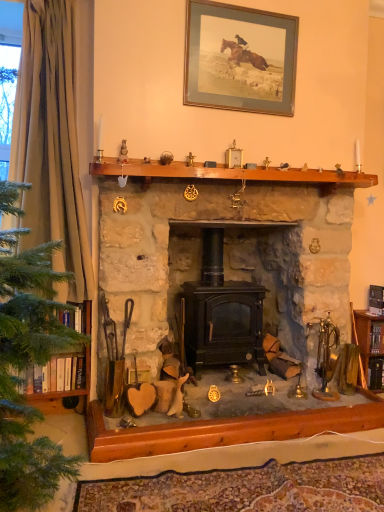
The image size is (384, 512). Describe the element at coordinates (228, 173) in the screenshot. I see `brown wooden mantle at upper center` at that location.

What is the approximate width of green fabric curtain at left?

green fabric curtain at left is 8.47 inches in width.

What are the coordinates of `gold-framed print at upper center` in the screenshot? It's located at (240, 58).

Considering the sizes of objects green fabric curtain at left and matte black wood-burning stove at center in the image provided, who is wider, green fabric curtain at left or matte black wood-burning stove at center?

matte black wood-burning stove at center.

Which object is more forward, green fabric curtain at left or matte black wood-burning stove at center?

matte black wood-burning stove at center.

Would you say green fabric curtain at left is a long distance from matte black wood-burning stove at center?

That's not correct — green fabric curtain at left is a little close to matte black wood-burning stove at center.

Can you confirm if matte black wood-burning stove at center is bigger than gold-framed print at upper center?

Indeed, matte black wood-burning stove at center has a larger size compared to gold-framed print at upper center.

Is matte black wood-burning stove at center beside gold-framed print at upper center?

matte black wood-burning stove at center and gold-framed print at upper center are not in contact.

Could you tell me if matte black wood-burning stove at center is turned towards gold-framed print at upper center?

No, matte black wood-burning stove at center is not oriented towards gold-framed print at upper center.

From the image's perspective, is matte black wood-burning stove at center positioned above or below gold-framed print at upper center?

matte black wood-burning stove at center is situated lower than gold-framed print at upper center in the image.

Can you confirm if brown wooden mantle at upper center is taller than gold-framed print at upper center?

No.

From the picture: Which object is closer to the camera, brown wooden mantle at upper center or gold-framed print at upper center?

brown wooden mantle at upper center.

From the image's perspective, does brown wooden mantle at upper center appear lower than gold-framed print at upper center?

Yes, from the image's perspective, brown wooden mantle at upper center is beneath gold-framed print at upper center.

Between point (336, 181) and point (276, 109), which one is positioned in front?

The point (276, 109) is in front.

Is gold-framed print at upper center to the left or to the right of green fabric curtain at left in the image?

In the image, gold-framed print at upper center appears on the right side of green fabric curtain at left.

Is gold-framed print at upper center not within green fabric curtain at left?

gold-framed print at upper center is positioned outside green fabric curtain at left.

From a real-world perspective, is gold-framed print at upper center positioned over green fabric curtain at left based on gravity?

Indeed, from a real-world perspective, gold-framed print at upper center stands above green fabric curtain at left.

Does point (186, 16) come in front of point (68, 195)?

That is True.

From the image's perspective, which one is positioned higher, gold-framed print at upper center or brown wooden mantle at upper center?

gold-framed print at upper center is shown above in the image.

In the scene shown: Is gold-framed print at upper center positioned with its back to brown wooden mantle at upper center?

No, gold-framed print at upper center's orientation is not away from brown wooden mantle at upper center.

What's the angular difference between gold-framed print at upper center and brown wooden mantle at upper center's facing directions?

gold-framed print at upper center and brown wooden mantle at upper center are facing 0.236 degrees away from each other.

Between point (286, 60) and point (235, 177), which one is positioned behind?

Positioned behind is point (286, 60).

Would you say matte black wood-burning stove at center is to the left or to the right of brown wooden mantle at upper center in the picture?

matte black wood-burning stove at center is positioned on brown wooden mantle at upper center's left side.

Can you confirm if matte black wood-burning stove at center is wider than brown wooden mantle at upper center?

Yes.

Is matte black wood-burning stove at center taller than brown wooden mantle at upper center?

Correct, matte black wood-burning stove at center is much taller as brown wooden mantle at upper center.

Could you measure the distance between matte black wood-burning stove at center and brown wooden mantle at upper center?

matte black wood-burning stove at center is 23.40 inches away from brown wooden mantle at upper center.

Is brown wooden mantle at upper center oriented away from matte black wood-burning stove at center?

No.

How many degrees apart are the facing directions of brown wooden mantle at upper center and matte black wood-burning stove at center?

brown wooden mantle at upper center and matte black wood-burning stove at center are facing 0.805 degrees away from each other.

Considering the relative sizes of brown wooden mantle at upper center and matte black wood-burning stove at center in the image provided, is brown wooden mantle at upper center bigger than matte black wood-burning stove at center?

No.

Find the location of `fireplace directly beneath the green fabric curtain at left (from a real-world perspective)`. fireplace directly beneath the green fabric curtain at left (from a real-world perspective) is located at coordinates (227, 255).

At what (x,y) coordinates should I click in order to perform the action: click on picture frame above the matte black wood-burning stove at center (from the image's perspective). Please return your answer as a coordinate pair (x, y). This screenshot has width=384, height=512. Looking at the image, I should click on (240, 58).

In the scene shown: When comparing their distances from brown wooden mantle at upper center, does gold-framed print at upper center or matte black wood-burning stove at center seem closer?

The object closer to brown wooden mantle at upper center is gold-framed print at upper center.

When comparing their distances from green fabric curtain at left, does brown wooden mantle at upper center or matte black wood-burning stove at center seem further?

matte black wood-burning stove at center.

Estimate the real-world distances between objects in this image. Which object is further from gold-framed print at upper center, green fabric curtain at left or matte black wood-burning stove at center?

green fabric curtain at left is positioned further to the anchor gold-framed print at upper center.

From the image, which object appears to be nearer to gold-framed print at upper center, brown wooden mantle at upper center or green fabric curtain at left?

brown wooden mantle at upper center.

Looking at the image, which one is located further to gold-framed print at upper center, matte black wood-burning stove at center or green fabric curtain at left?

Among the two, green fabric curtain at left is located further to gold-framed print at upper center.

Looking at the image, which one is located further to brown wooden mantle at upper center, matte black wood-burning stove at center or green fabric curtain at left?

matte black wood-burning stove at center is further to brown wooden mantle at upper center.

Considering their positions, is green fabric curtain at left positioned closer to matte black wood-burning stove at center than gold-framed print at upper center?

The object closer to matte black wood-burning stove at center is green fabric curtain at left.

Which object lies further to the anchor point gold-framed print at upper center, green fabric curtain at left or brown wooden mantle at upper center?

green fabric curtain at left is positioned further to the anchor gold-framed print at upper center.

This screenshot has height=512, width=384. What are the coordinates of `curtain that lies between gold-framed print at upper center and matte black wood-burning stove at center from top to bottom` in the screenshot? It's located at (51, 142).

Locate an element on the screen. The width and height of the screenshot is (384, 512). fireplace between green fabric curtain at left and brown wooden mantle at upper center is located at coordinates [x=227, y=255].

This screenshot has height=512, width=384. Identify the location of picture frame between green fabric curtain at left and brown wooden mantle at upper center in the horizontal direction. (240, 58).

Find the location of a particular element. This screenshot has width=384, height=512. mantle between gold-framed print at upper center and matte black wood-burning stove at center vertically is located at coordinates (228, 173).